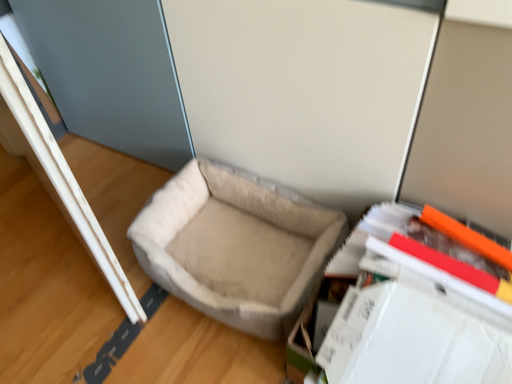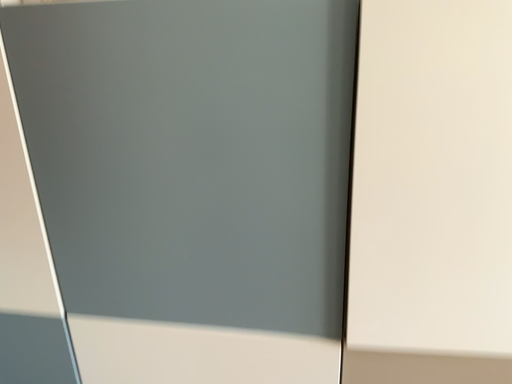
Question: Which way did the camera rotate in the video?

Choices:
 (A) rotated downward
 (B) rotated upward

Answer: (B)